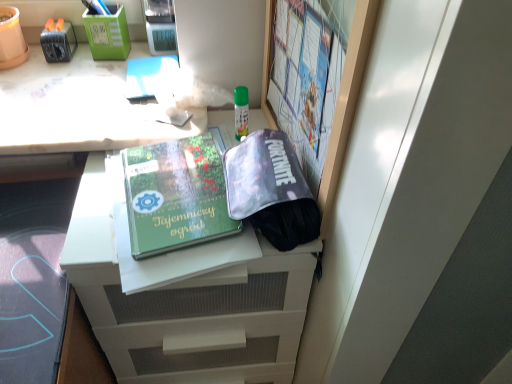
Identify the location of blank space above green matte book at center (from a real-world perspective). The image size is (512, 384). (175, 185).